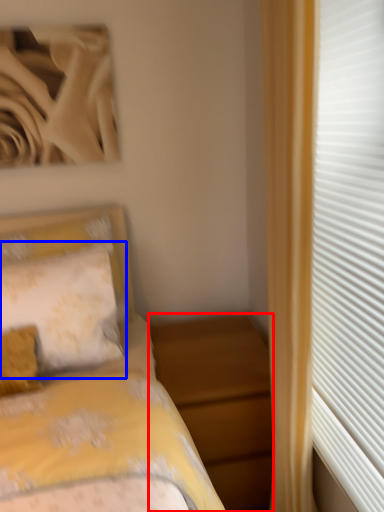
Question: Which of the following is the farthest to the observer, nightstand (highlighted by a red box) or pillow (highlighted by a blue box)?

Choices:
 (A) nightstand
 (B) pillow

Answer: (B)